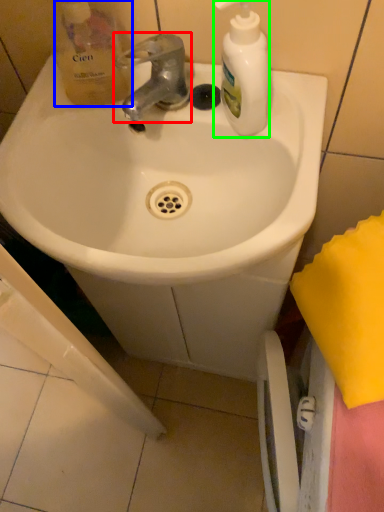
Question: Which is farther away from tap (highlighted by a red box)? product (highlighted by a blue box) or cleaning product (highlighted by a green box)?

Choices:
 (A) product
 (B) cleaning product

Answer: (B)